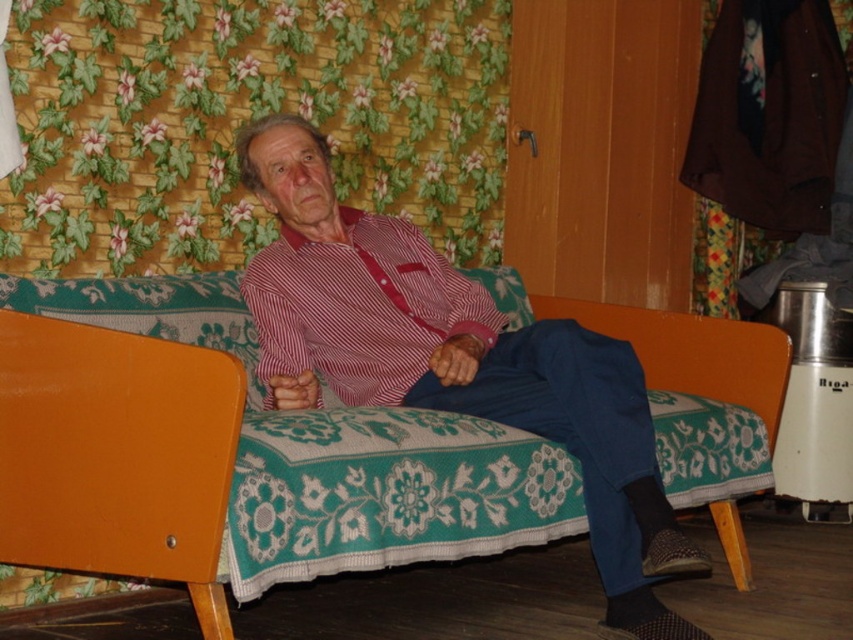
Question: Is orange fabric couch at center thinner than striped cotton shirt at center?

Choices:
 (A) yes
 (B) no

Answer: (B)

Question: Estimate the real-world distances between objects in this image. Which object is farther from the matte red shirt at center?

Choices:
 (A) orange fabric couch at center
 (B) striped cotton shirt at center

Answer: (A)

Question: Does striped cotton shirt at center have a smaller size compared to red striped fabric suspenders at center?

Choices:
 (A) yes
 (B) no

Answer: (B)

Question: Which object is positioned farthest from the red striped fabric suspenders at center?

Choices:
 (A) orange fabric couch at center
 (B) striped cotton shirt at center
 (C) matte red shirt at center

Answer: (A)

Question: Considering the real-world distances, which object is farthest from the orange fabric couch at center?

Choices:
 (A) red striped fabric suspenders at center
 (B) matte red shirt at center
 (C) striped cotton shirt at center

Answer: (A)

Question: Is orange fabric couch at center wider than striped cotton shirt at center?

Choices:
 (A) yes
 (B) no

Answer: (A)